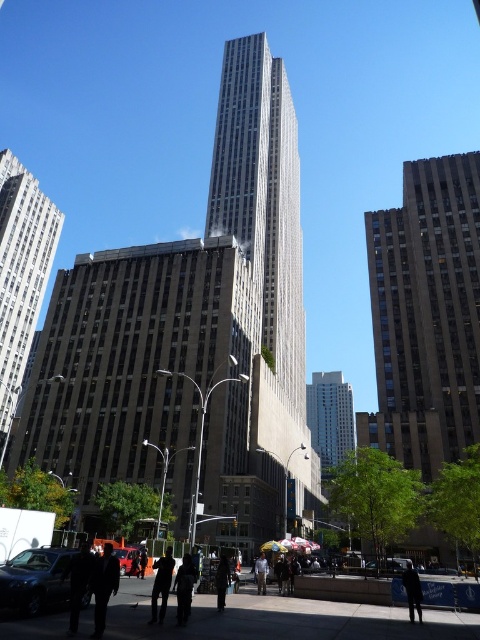
You are a delivery person who needs to move a 1.2 meter wide package from the shiny black sedan at lower left to the dark gray suit at center. Can you carry it directly without moving the package sideways?

The distance between the shiny black sedan at lower left and the dark gray suit at center is 8.33 meters. Since the package is 1.2 meters wide, you can carry it directly as the distance is sufficient.

You are standing in the bustling urban scene with the Rockefeller Center in the center. You see two points marked on the ground in front of you. The first point is at coordinates point (95,593) and the second point is at point (74,554). Which point is closer to you?

Point (95,593) is closer to the viewer than point (74,554).

You are standing in the plaza and see the point labeled as point (36, 580). What object is this point located on?

The point (36, 580) is located on the shiny black sedan at lower left.